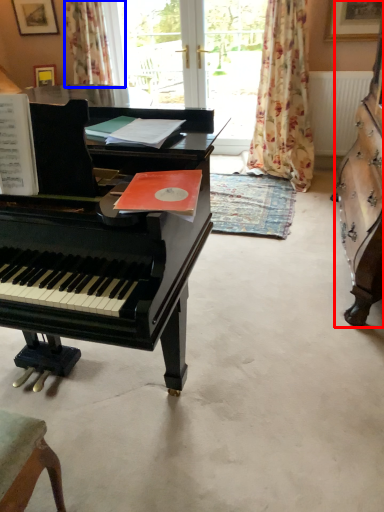
Question: Which object is closer to the camera taking this photo, harpsichord (highlighted by a red box) or curtain (highlighted by a blue box)?

Choices:
 (A) harpsichord
 (B) curtain

Answer: (A)